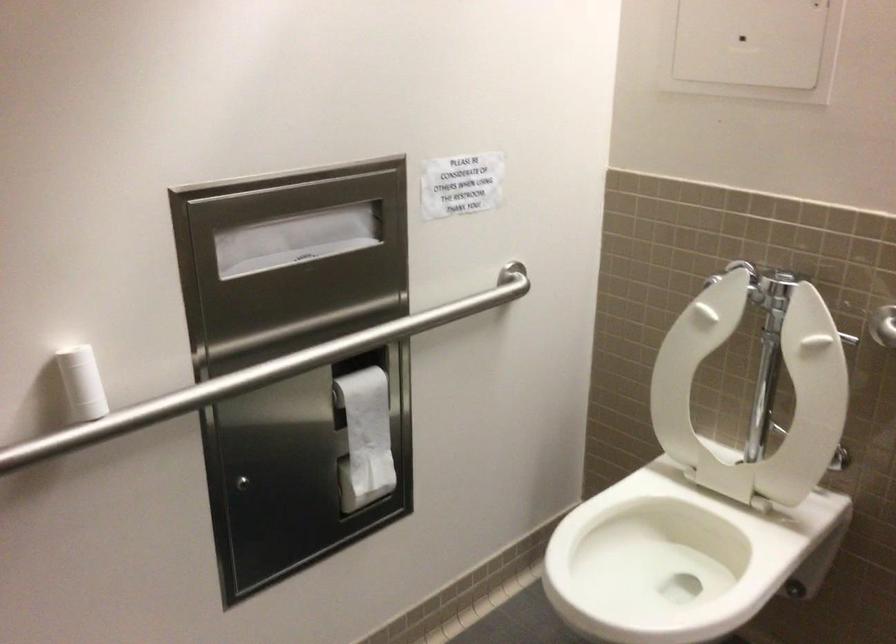
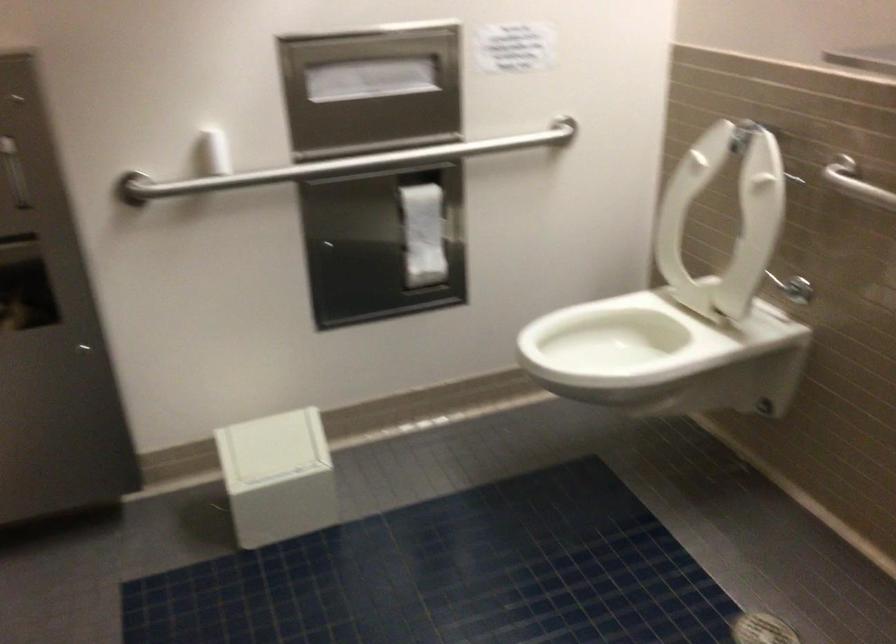
Find the pixel in the second image that matches point (707, 373) in the first image.

(724, 219)